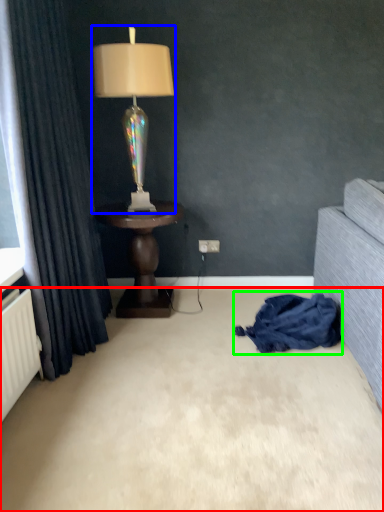
Question: Which object is positioned farthest from plain (highlighted by a red box)? Select from lamp (highlighted by a blue box) and blanket (highlighted by a green box).

Choices:
 (A) lamp
 (B) blanket

Answer: (A)